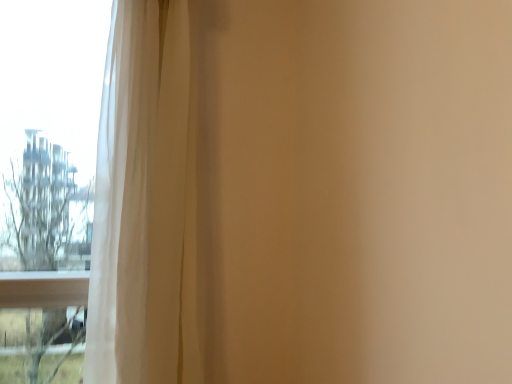
Question: Is point (44, 268) closer or farther from the camera than point (170, 316)?

Choices:
 (A) closer
 (B) farther

Answer: (B)

Question: Is transparent glass window at left situated inside white sheer curtain at left or outside?

Choices:
 (A) outside
 (B) inside

Answer: (A)

Question: Relative to white sheer curtain at left, is transparent glass window at left in front or behind?

Choices:
 (A) front
 (B) behind

Answer: (B)

Question: From their relative heights in the image, would you say white sheer curtain at left is taller or shorter than transparent glass window at left?

Choices:
 (A) short
 (B) tall

Answer: (A)

Question: Would you say white sheer curtain at left is to the left or to the right of transparent glass window at left in the picture?

Choices:
 (A) left
 (B) right

Answer: (B)

Question: Looking at the image, does white sheer curtain at left seem bigger or smaller compared to transparent glass window at left?

Choices:
 (A) big
 (B) small

Answer: (A)

Question: Is white sheer curtain at left spatially inside transparent glass window at left, or outside of it?

Choices:
 (A) inside
 (B) outside

Answer: (B)